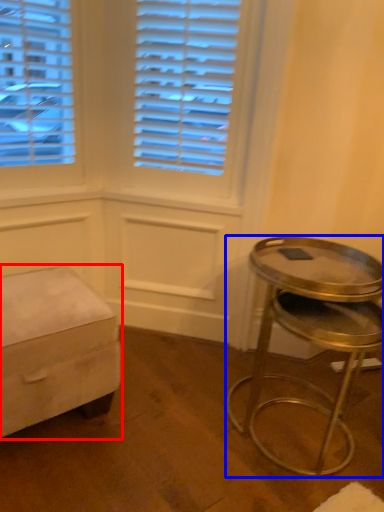
Question: Among these objects, which one is farthest to the camera, furniture (highlighted by a red box) or stool (highlighted by a blue box)?

Choices:
 (A) furniture
 (B) stool

Answer: (A)